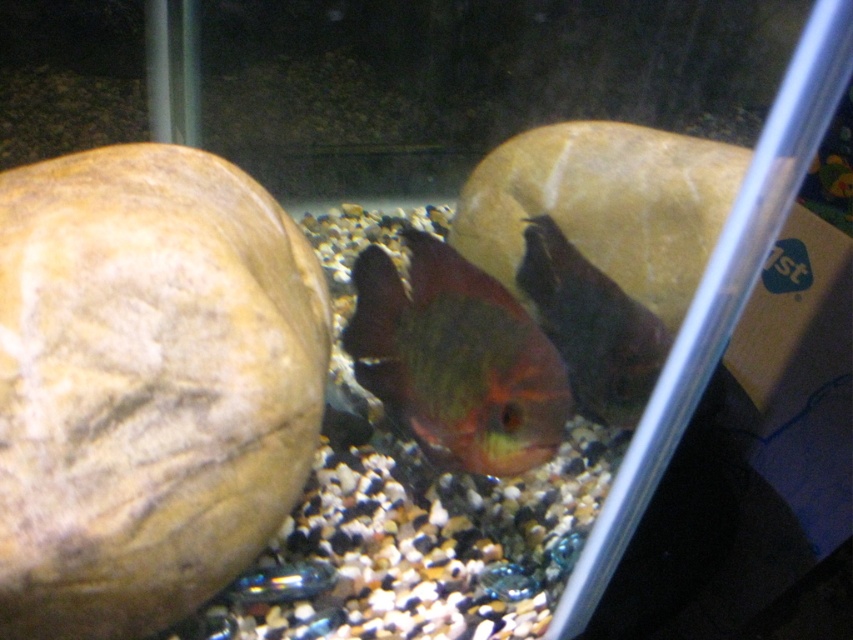
You are an aquarist who needs to place a new plant between the shiny greenish fish at center and the stones in the foreground. How far apart should you position the plant from each object?

The plant should be placed 1.91 feet away from both the shiny greenish fish at center and the stones in the foreground to maintain equal distance between them, as they are 3.82 feet apart.